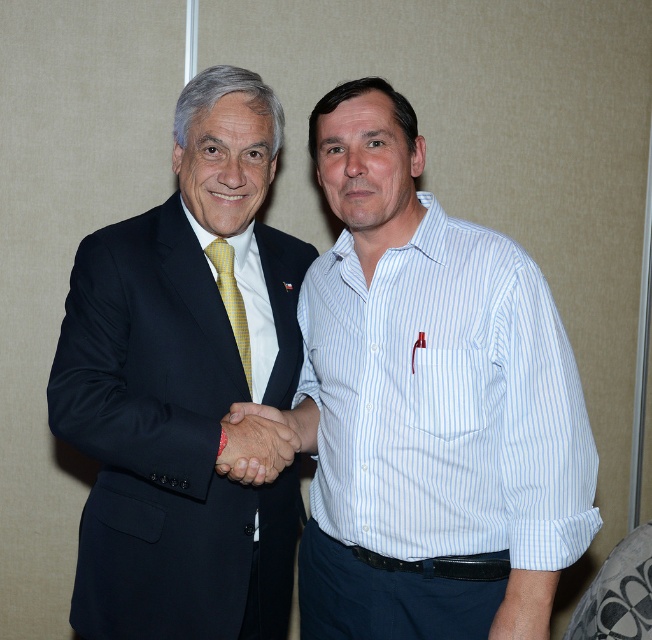
Question: Is white striped shirt at center further to camera compared to smooth skin handshake at center?

Choices:
 (A) yes
 (B) no

Answer: (B)

Question: Which point appears farthest from the camera in this image?

Choices:
 (A) (333, 410)
 (B) (188, 545)
 (C) (241, 320)

Answer: (C)

Question: Which of these objects is positioned closest to the yellowtexturetie at center?

Choices:
 (A) white striped shirt at center
 (B) smooth skin handshake at center
 (C) matte black suit at left

Answer: (B)

Question: Is smooth skin handshake at center smaller than yellowtexturetie at center?

Choices:
 (A) no
 (B) yes

Answer: (A)

Question: Is matte black suit at left closer to camera compared to yellowtexturetie at center?

Choices:
 (A) no
 (B) yes

Answer: (B)

Question: Which of the following is the farthest from the observer?

Choices:
 (A) smooth skin handshake at center
 (B) yellowtexturetie at center
 (C) white striped shirt at center

Answer: (B)